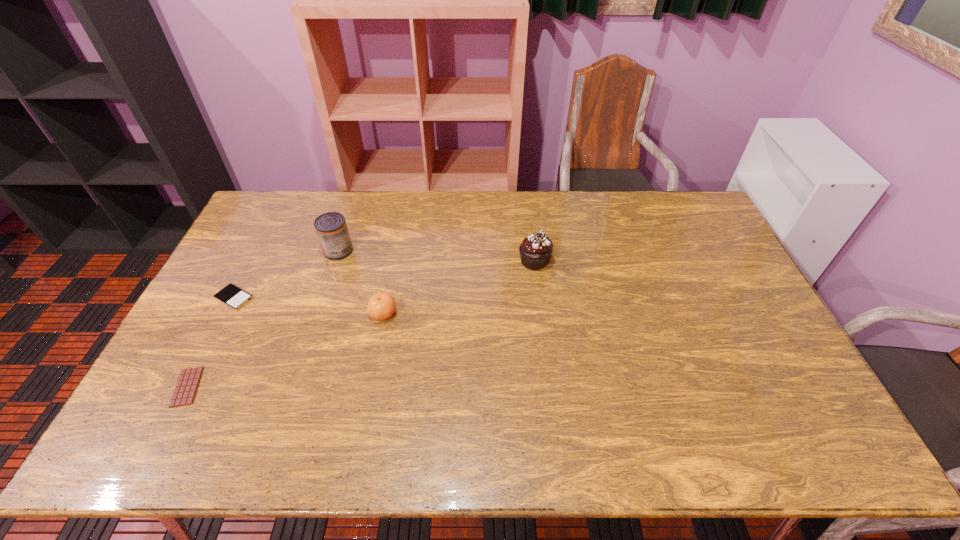
This screenshot has width=960, height=540. Find the location of `vacant region located on the back of the iPod`. vacant region located on the back of the iPod is located at coordinates (275, 220).

Where is `vacant space located on the right of the nearest object`? vacant space located on the right of the nearest object is located at coordinates (299, 387).

What are the coordinates of `iPod at the left edge` in the screenshot? It's located at (234, 297).

At what (x,y) coordinates should I click in order to perform the action: click on candy bar that is at the left edge. Please return your answer as a coordinate pair (x, y). This screenshot has width=960, height=540. Looking at the image, I should click on (186, 387).

I want to click on free space at the far edge of the desktop, so tap(450, 195).

Where is `vacant space at the near edge of the desktop`? The height and width of the screenshot is (540, 960). vacant space at the near edge of the desktop is located at coordinates (630, 451).

Find the location of a particular element. Image resolution: width=960 pixels, height=540 pixels. vacant region at the left edge of the desktop is located at coordinates (230, 319).

Where is `free space at the right edge of the desktop`? The image size is (960, 540). free space at the right edge of the desktop is located at coordinates [x=677, y=234].

Locate an element on the screen. vacant space at the far left corner of the desktop is located at coordinates (302, 195).

At what (x,y) coordinates should I click in order to perform the action: click on vacant space at the far right corner of the desktop. Please return your answer as a coordinate pair (x, y). Image resolution: width=960 pixels, height=540 pixels. Looking at the image, I should click on (660, 195).